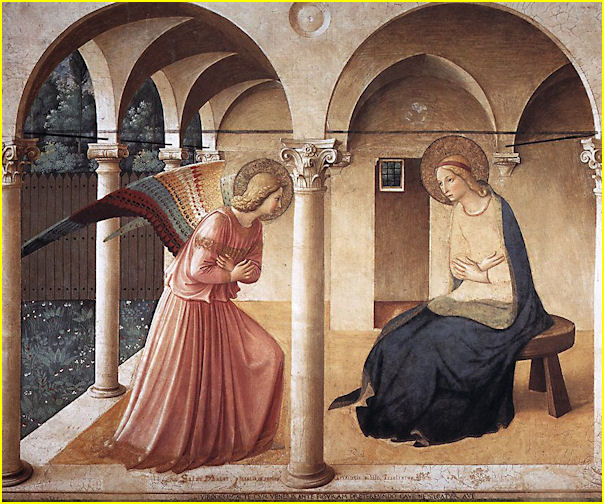
Identify the location of pillars. The width and height of the screenshot is (604, 504). point(304,249), point(113,262), point(8,298).